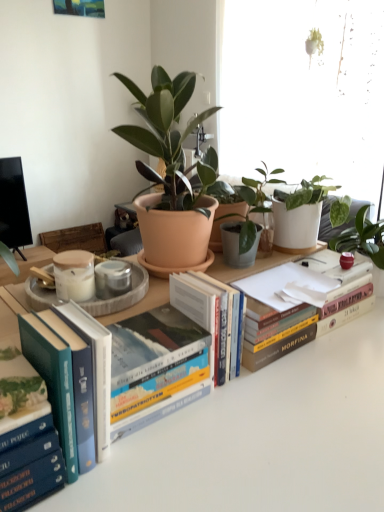
Question: In the image, is hardcover books at left, which appears as the fourth book when viewed from the right, on the left side or the right side of hardcover book at center, placed as the 5th book when sorted from left to right?

Choices:
 (A) right
 (B) left

Answer: (B)

Question: Looking at the image, does hardcover books at left, which appears as the fourth book when viewed from the right, seem bigger or smaller compared to hardcover book at center, placed as the first book when sorted from right to left?

Choices:
 (A) small
 (B) big

Answer: (A)

Question: Estimate the real-world distances between objects in this image. Which object is closer to the blue hardcover book at lower left, which is the 1th book in left-to-right order?

Choices:
 (A) hardcover book at center, placed as the 4th book when sorted from left to right
 (B) matte terracotta pot at center
 (C) hardcover book at center, placed as the 5th book when sorted from left to right
 (D) hardcover book at center, positioned as the third book in left-to-right order
 (E) hardcover books at left, arranged as the 2th book when viewed from the left

Answer: (E)

Question: Based on their relative distances, which object is nearer to the hardcover book at center, placed as the first book when sorted from right to left?

Choices:
 (A) matte terracotta pot at center
 (B) hardcover book at center, positioned as the third book in left-to-right order
 (C) blue hardcover book at lower left, which is the 1th book in left-to-right order
 (D) hardcover book at center, which is the 2th book from right to left
 (E) hardcover books at left, arranged as the 2th book when viewed from the left

Answer: (D)